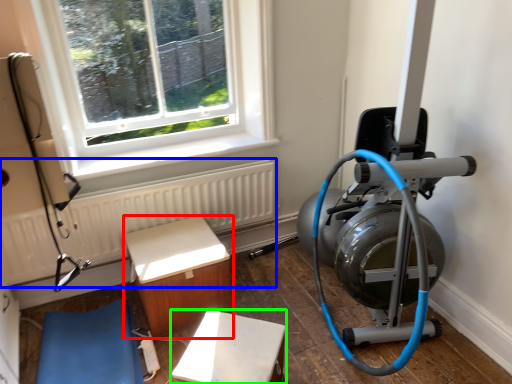
Question: Estimate the real-world distances between objects in this image. Which object is closer to furniture (highlighted by a red box), radiator (highlighted by a blue box) or furniture (highlighted by a green box)?

Choices:
 (A) radiator
 (B) furniture

Answer: (A)